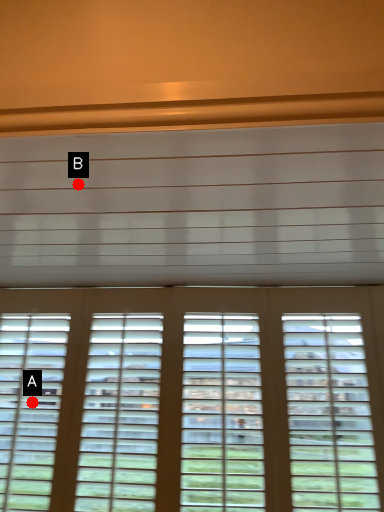
Question: Two points are circled on the image, labeled by A and B beside each circle. Which point appears closest to the camera in this image?

Choices:
 (A) A is closer
 (B) B is closer

Answer: (B)